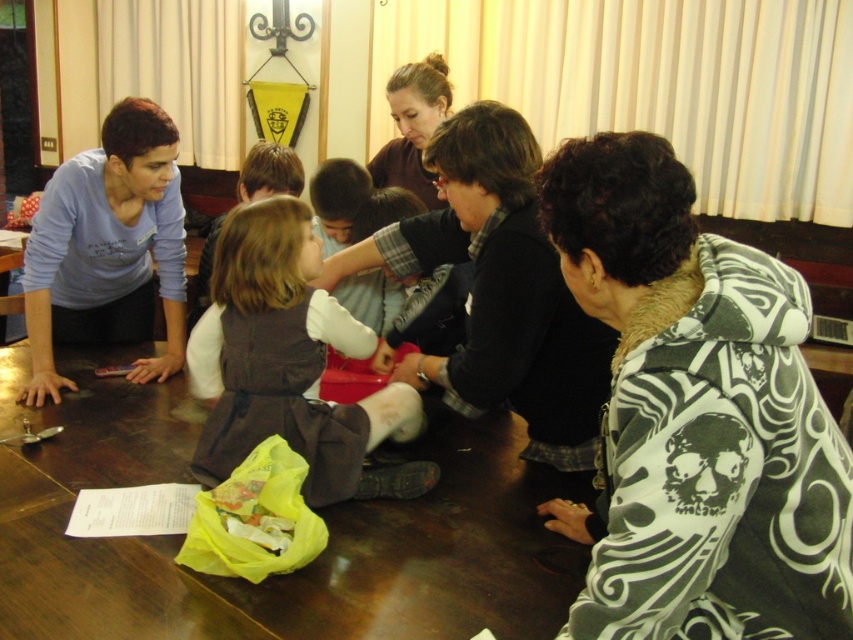
Question: Which point appears farthest from the camera in this image?

Choices:
 (A) (401, 83)
 (B) (238, 305)
 (C) (769, 570)

Answer: (A)

Question: Which of the following is the farthest from the observer?

Choices:
 (A) brown polished wood table at center
 (B) brown matte hair at upper center
 (C) dark gray fabric dress at center
 (D) matte blue shirt at left

Answer: (B)

Question: Is dark green hoodie at lower right bigger than brown polished wood table at center?

Choices:
 (A) no
 (B) yes

Answer: (A)

Question: Which point is closer to the camera taking this photo?

Choices:
 (A) tap(373, 173)
 (B) tap(271, 420)
 (C) tap(779, 566)

Answer: (C)

Question: Is black sweater at center thinner than matte blue shirt at left?

Choices:
 (A) yes
 (B) no

Answer: (A)

Question: Does dark gray fabric dress at center appear on the left side of brown matte hair at upper center?

Choices:
 (A) yes
 (B) no

Answer: (A)